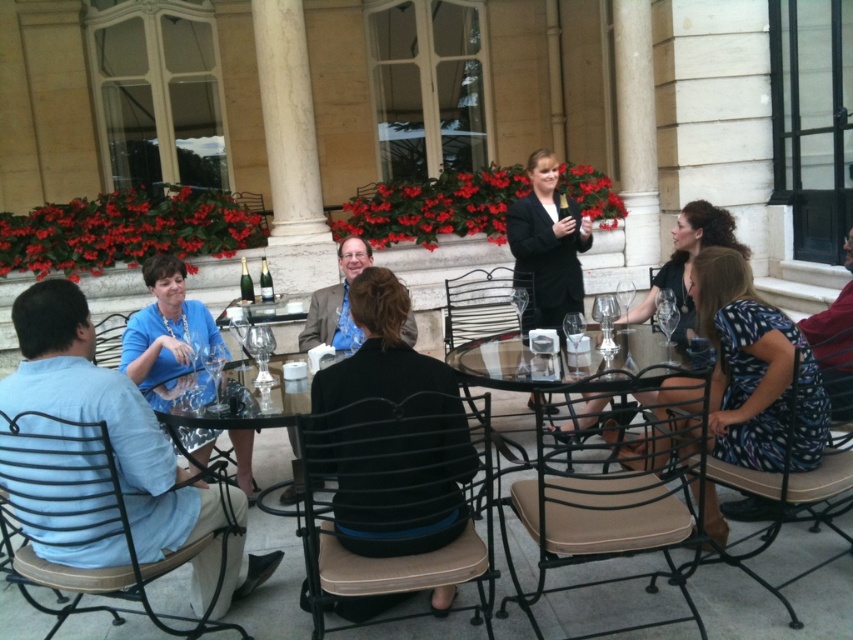
Question: Which of the following is the closest to the observer?

Choices:
 (A) light blue shirt at left
 (B) matte brown suit at center

Answer: (A)

Question: Does light blue shirt at left have a greater width compared to matte brown suit at center?

Choices:
 (A) yes
 (B) no

Answer: (A)

Question: Can you confirm if light blue shirt at left is bigger than matte brown suit at center?

Choices:
 (A) no
 (B) yes

Answer: (B)

Question: Which object is closer to the camera taking this photo?

Choices:
 (A) light blue shirt at left
 (B) matte brown suit at center

Answer: (A)

Question: In this image, where is light blue shirt at left located relative to matte brown suit at center?

Choices:
 (A) left
 (B) right

Answer: (A)